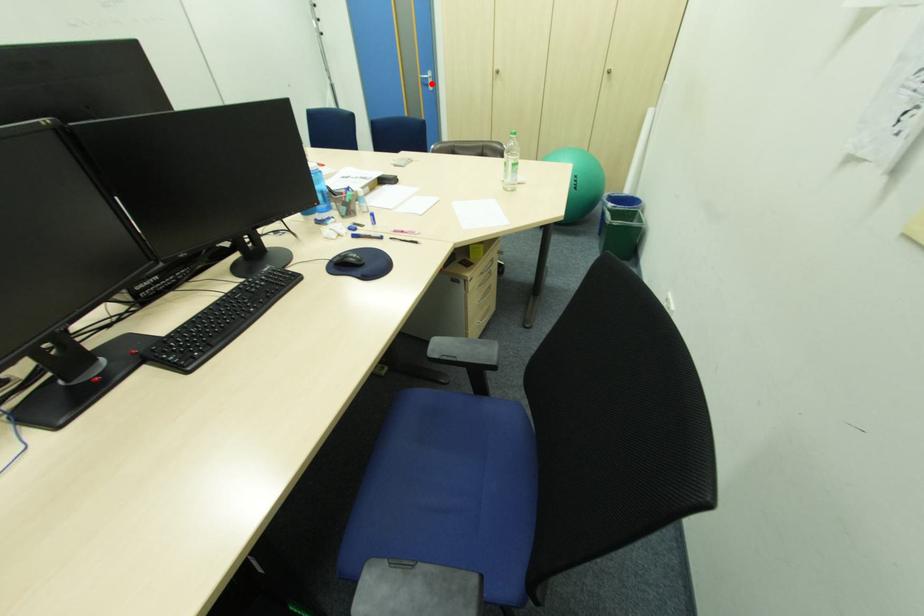
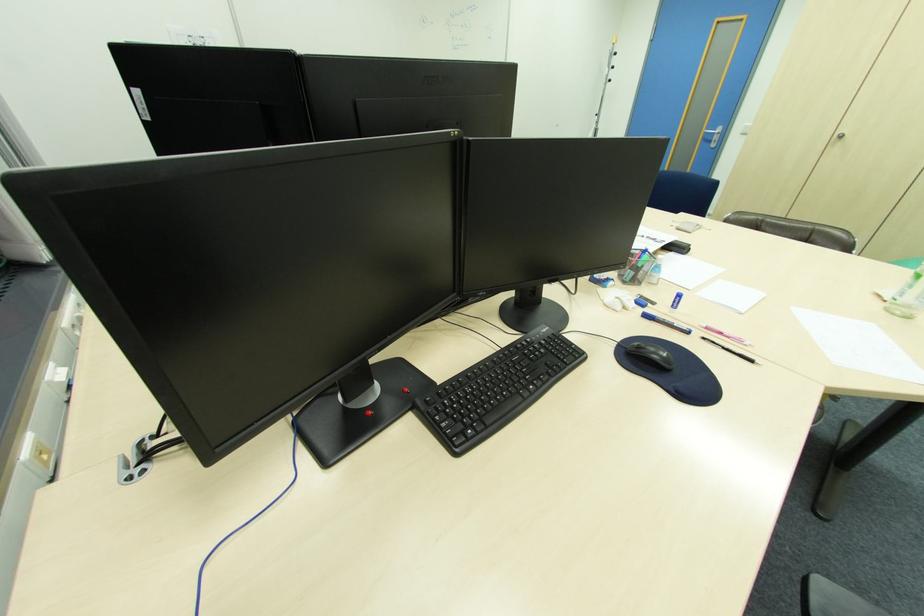
Where in the second image is the point corresponding to the highlighted location from the first image?

(713, 139)